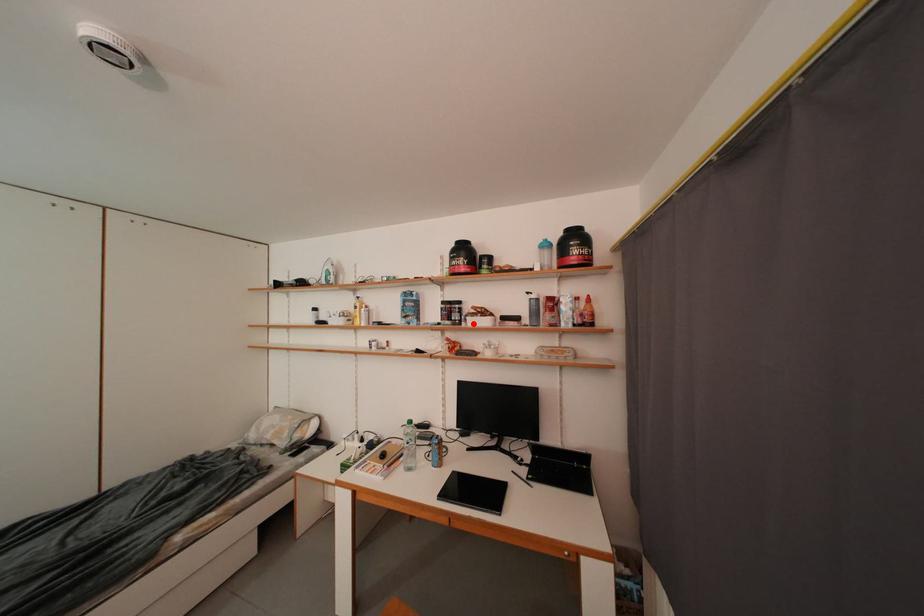
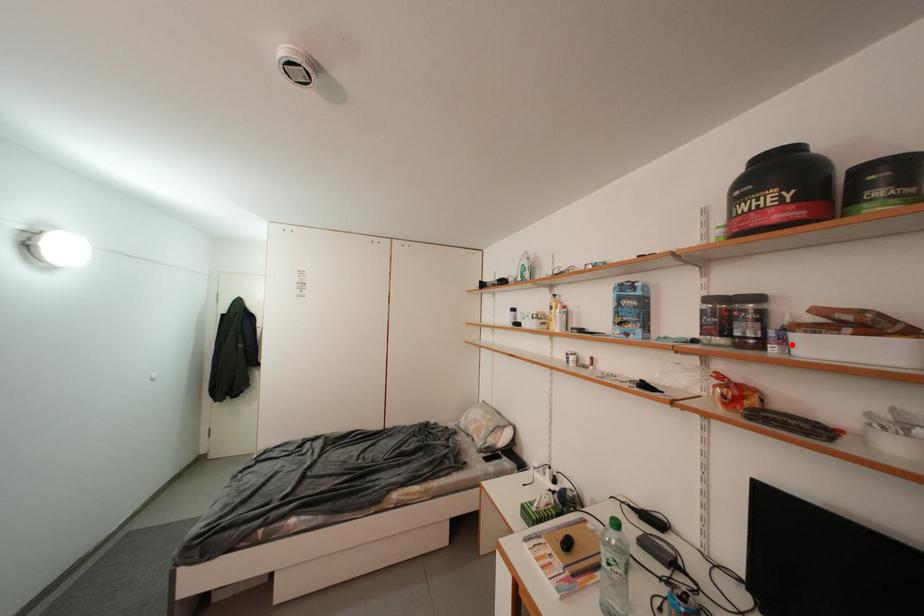
I am providing you with two images of the same scene from different viewpoints. A red point is marked on the first image and another point is marked on the second image. Is the red point in image1 aligned with the point shown in image2?

Yes